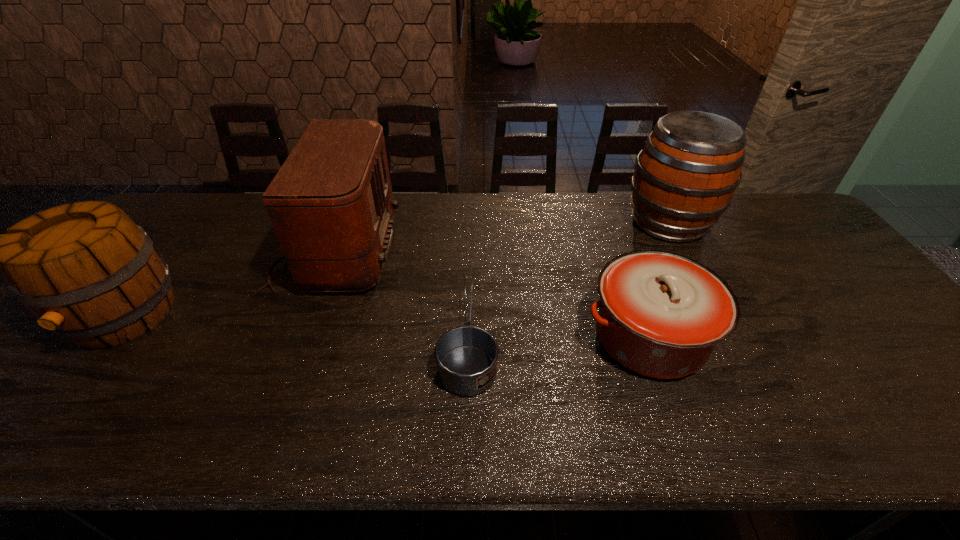
Where is `blank space at the right edge`? Image resolution: width=960 pixels, height=540 pixels. blank space at the right edge is located at coordinates (795, 264).

I want to click on free space that is in between the leftmost object and the fourth tallest object, so click(386, 327).

Find the location of a particular element. vacant area that lies between the left cider and the radio receiver is located at coordinates (229, 283).

Identify the location of vacant space in between the right cider and the leftmost object. The image size is (960, 540). (396, 269).

The height and width of the screenshot is (540, 960). Identify the location of unoccupied area between the shortest object and the right cider. (568, 281).

Locate an element on the screen. This screenshot has width=960, height=540. free space between the shortest object and the leftmost object is located at coordinates (296, 328).

Locate an element on the screen. vacant region between the left cider and the second shortest object is located at coordinates (386, 327).

At what (x,y) coordinates should I click in order to perform the action: click on empty space that is in between the shorter cider and the saucepan. Please return your answer as a coordinate pair (x, y). The image size is (960, 540). Looking at the image, I should click on (296, 328).

You are a GUI agent. You are given a task and a screenshot of the screen. Output one action in this format:
    pyautogui.click(x=<x>, y=<y>)
    Task: Click on the unoccupied area between the saucepan and the radio receiver
    The height and width of the screenshot is (540, 960).
    Given the screenshot: What is the action you would take?
    pyautogui.click(x=402, y=295)

Identify the location of vacant area that lies between the saucepan and the farther cider. (568, 281).